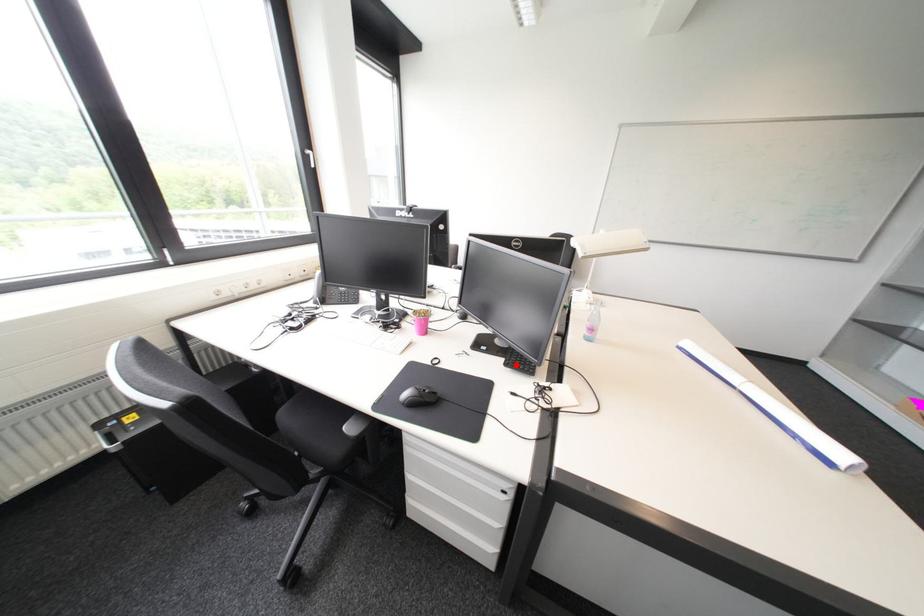
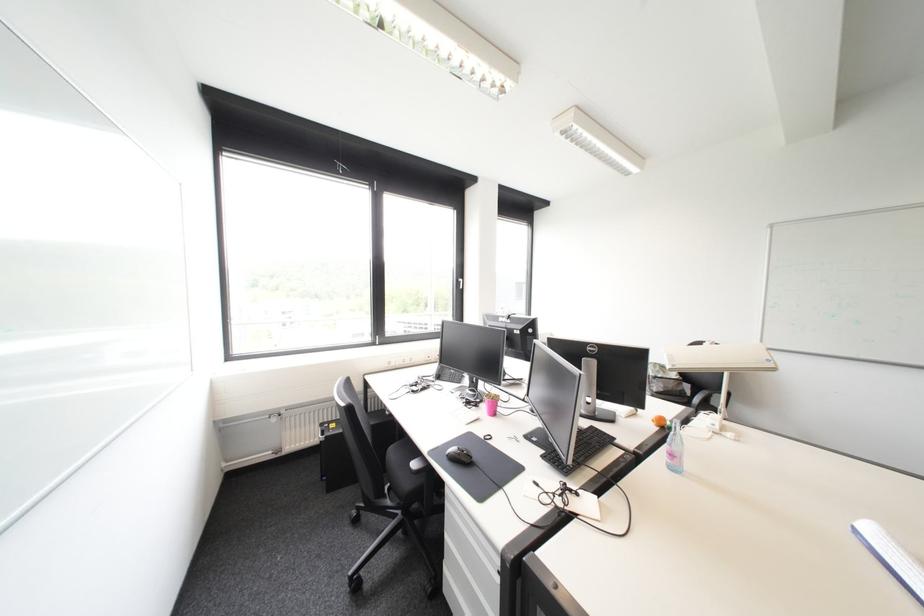
Locate, in the second image, the point that corresponds to the highlighted location in the first image.

(553, 458)